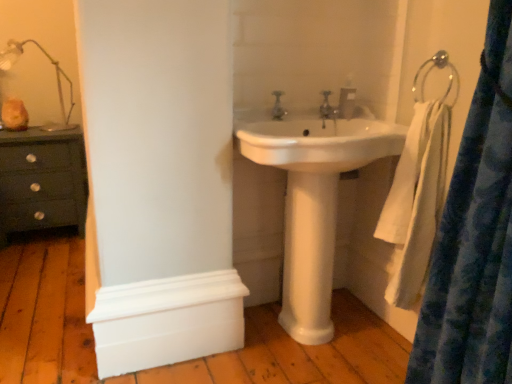
In order to click on empty space that is in between matte silver faucet at center, positioned as the 1th tap in front-to-back order, and silver metallic faucet at center, positioned as the first tap in right-to-left order in this screenshot , I will do `click(304, 113)`.